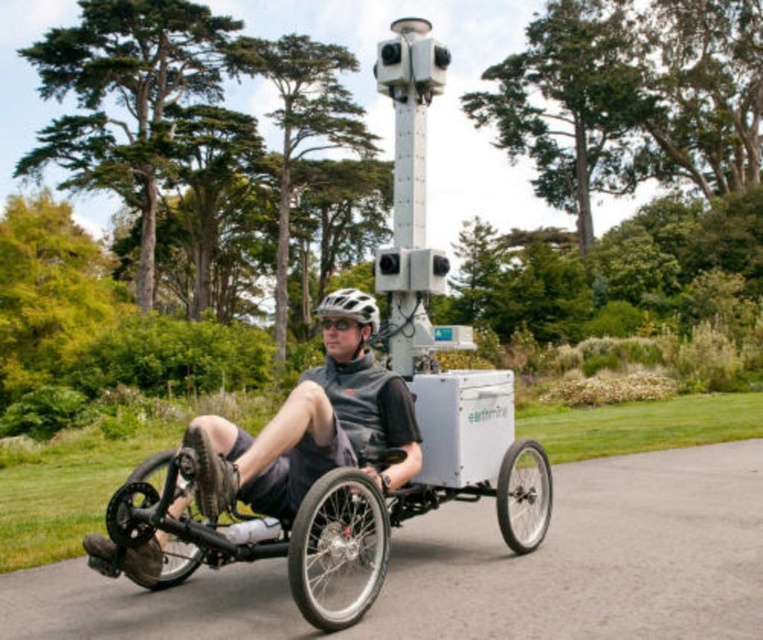
You are a photographer trying to set up a camera on the tricycle. You need to know which object is taller between the shiny silver rim at center and the black rubber wheel at lower left. Which one is taller?

The black rubber wheel at lower left is taller than the shiny silver rim at center.